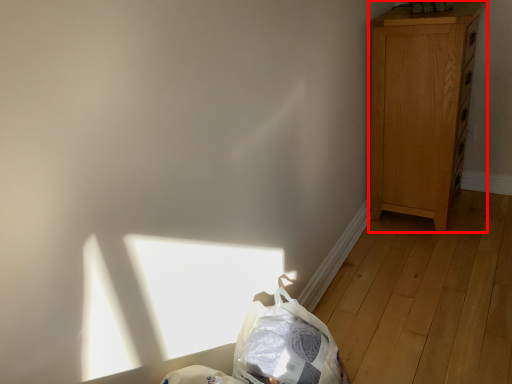
Question: From the image's perspective, what is the correct spatial relationship of dresser (annotated by the red box) in relation to diaper bag?

Choices:
 (A) below
 (B) above

Answer: (B)